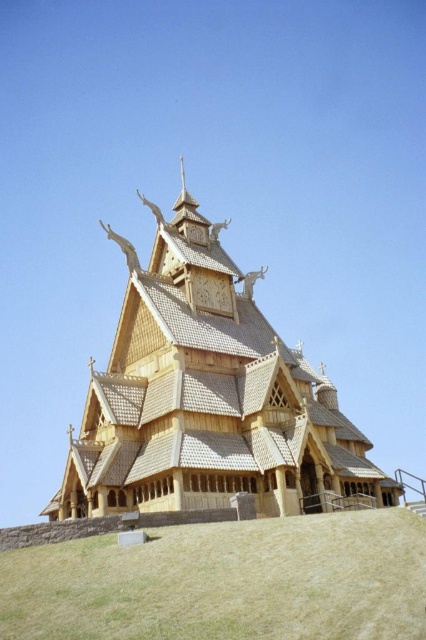
Question: Is natural wood church at center closer to the viewer compared to yellowish-green grass at lower center?

Choices:
 (A) yes
 (B) no

Answer: (B)

Question: Does natural wood church at center have a lesser width compared to yellowish-green grass at lower center?

Choices:
 (A) yes
 (B) no

Answer: (B)

Question: Among these points, which one is nearest to the camera?

Choices:
 (A) (296, 470)
 (B) (336, 518)

Answer: (B)

Question: Does natural wood church at center have a lesser width compared to yellowish-green grass at lower center?

Choices:
 (A) no
 (B) yes

Answer: (A)